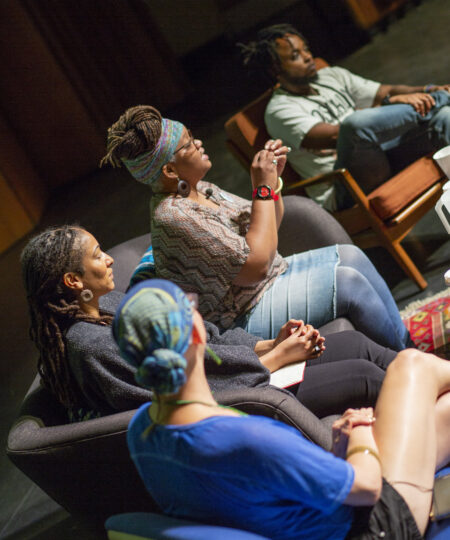
At what (x,y) coordinates should I click in order to perform the action: click on chairs. Please return your answer as a coordinate pair (x, y). The image size is (450, 540). Looking at the image, I should click on (396, 195), (169, 525), (96, 438).